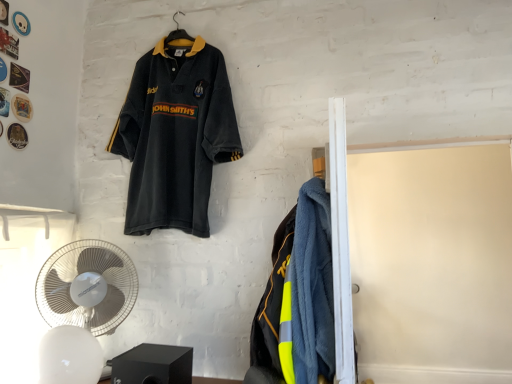
Question: Does white plastic mechanical fan at lower left, positioned as the 2th mechanical fan in back-to-front order, have a smaller size compared to white plastic fan at lower left, the 1th mechanical fan in the back-to-front sequence?

Choices:
 (A) yes
 (B) no

Answer: (A)

Question: Considering the relative sizes of white plastic mechanical fan at lower left, positioned as the 2th mechanical fan in back-to-front order, and white plastic fan at lower left, the 1th mechanical fan in the back-to-front sequence, in the image provided, is white plastic mechanical fan at lower left, positioned as the 2th mechanical fan in back-to-front order, thinner than white plastic fan at lower left, the 1th mechanical fan in the back-to-front sequence,?

Choices:
 (A) no
 (B) yes

Answer: (A)

Question: Considering the relative sizes of white plastic mechanical fan at lower left, the 1th mechanical fan from the front, and white plastic fan at lower left, the 1th mechanical fan in the back-to-front sequence, in the image provided, is white plastic mechanical fan at lower left, the 1th mechanical fan from the front, shorter than white plastic fan at lower left, the 1th mechanical fan in the back-to-front sequence,?

Choices:
 (A) yes
 (B) no

Answer: (A)

Question: Considering the relative sizes of white plastic mechanical fan at lower left, positioned as the 2th mechanical fan in back-to-front order, and white plastic fan at lower left, which ranks as the 2th mechanical fan in front-to-back order, in the image provided, is white plastic mechanical fan at lower left, positioned as the 2th mechanical fan in back-to-front order, taller than white plastic fan at lower left, which ranks as the 2th mechanical fan in front-to-back order,?

Choices:
 (A) yes
 (B) no

Answer: (B)

Question: Is white plastic mechanical fan at lower left, the 1th mechanical fan from the front, wider than white plastic fan at lower left, the 1th mechanical fan in the back-to-front sequence?

Choices:
 (A) no
 (B) yes

Answer: (B)

Question: Considering the positions of point (96, 312) and point (225, 140), is point (96, 312) closer or farther from the camera than point (225, 140)?

Choices:
 (A) closer
 (B) farther

Answer: (A)

Question: Considering the positions of white plastic fan at lower left, which ranks as the 2th mechanical fan in front-to-back order, and velvet-like dark blue polo shirt at upper left in the image, is white plastic fan at lower left, which ranks as the 2th mechanical fan in front-to-back order, wider or thinner than velvet-like dark blue polo shirt at upper left?

Choices:
 (A) wide
 (B) thin

Answer: (B)

Question: Is white plastic fan at lower left, which ranks as the 2th mechanical fan in front-to-back order, inside or outside of velvet-like dark blue polo shirt at upper left?

Choices:
 (A) inside
 (B) outside

Answer: (B)

Question: Is white plastic fan at lower left, the 1th mechanical fan in the back-to-front sequence, in front of or behind velvet-like dark blue polo shirt at upper left in the image?

Choices:
 (A) front
 (B) behind

Answer: (A)

Question: Is white plastic fan at lower left, which ranks as the 2th mechanical fan in front-to-back order, spatially inside white plastic mechanical fan at lower left, the 1th mechanical fan from the front, or outside of it?

Choices:
 (A) inside
 (B) outside

Answer: (B)

Question: Looking at their shapes, would you say white plastic fan at lower left, the 1th mechanical fan in the back-to-front sequence, is wider or thinner than white plastic mechanical fan at lower left, positioned as the 2th mechanical fan in back-to-front order?

Choices:
 (A) wide
 (B) thin

Answer: (B)

Question: Is white plastic fan at lower left, the 1th mechanical fan in the back-to-front sequence, taller or shorter than white plastic mechanical fan at lower left, positioned as the 2th mechanical fan in back-to-front order?

Choices:
 (A) tall
 (B) short

Answer: (A)

Question: Is point (108, 294) closer or farther from the camera than point (59, 382)?

Choices:
 (A) farther
 (B) closer

Answer: (A)

Question: In terms of height, does velvet-like dark blue polo shirt at upper left look taller or shorter compared to white plastic fan at lower left, the 1th mechanical fan in the back-to-front sequence?

Choices:
 (A) short
 (B) tall

Answer: (B)

Question: Is velvet-like dark blue polo shirt at upper left situated inside white plastic fan at lower left, the 1th mechanical fan in the back-to-front sequence, or outside?

Choices:
 (A) outside
 (B) inside

Answer: (A)